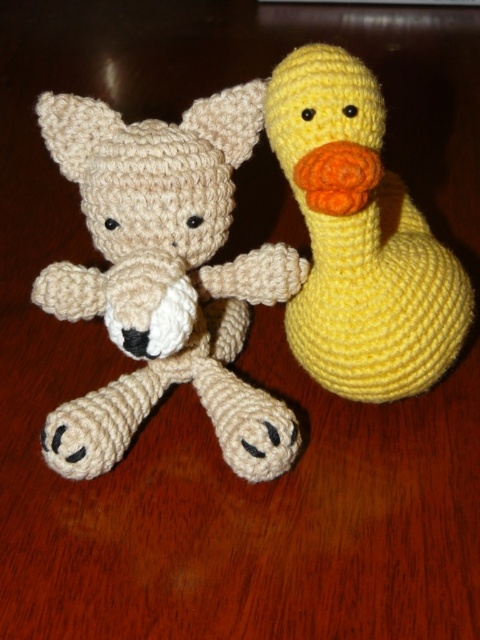
You are a child who wants to place both the beige yarn stuffed animal at left and the yellow yarn duck at right on a small shelf. Considering their sizes, which one should you place first to ensure both fit properly?

The beige yarn stuffed animal at left is much taller than the yellow yarn duck at right. To ensure both fit on the small shelf, place the taller beige yarn stuffed animal at left first, then the shorter yellow yarn duck at right.

You are organizing a toy store shelf and need to place the beige yarn stuffed animal at left and the yellow yarn duck at right. According to the image, which toy is placed higher on the shelf?

The yellow yarn duck at right is placed higher than the beige yarn stuffed animal at left because the beige yarn stuffed animal at left is positioned under it.

You are standing in front of a wooden table with two crocheted toys. You need to place a new toy between the beige yarn stuffed animal at left and the yellow crocheted duck on the right. Based on their positions, where should you place the new toy?

The beige yarn stuffed animal at left is located at point 0.434 on the x and y axis. Since the duck is on the right, the new toy should be placed between these two coordinates.